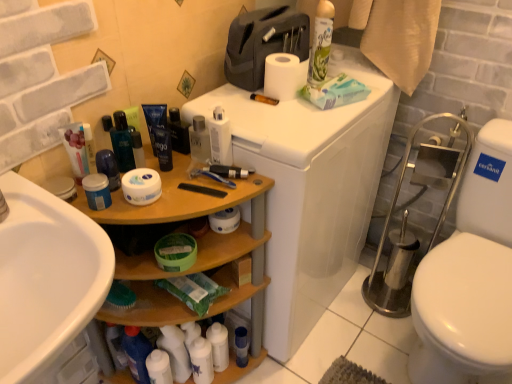
Question: Can we say wooden shelf at left lies outside shiny blue bottle at center?

Choices:
 (A) yes
 (B) no

Answer: (A)

Question: Does wooden shelf at left come behind shiny blue bottle at center?

Choices:
 (A) yes
 (B) no

Answer: (B)

Question: Does wooden shelf at left contain shiny blue bottle at center?

Choices:
 (A) yes
 (B) no

Answer: (B)

Question: From the image's perspective, is wooden shelf at left beneath shiny blue bottle at center?

Choices:
 (A) no
 (B) yes

Answer: (B)

Question: Does wooden shelf at left appear on the left side of shiny blue bottle at center?

Choices:
 (A) yes
 (B) no

Answer: (B)

Question: From a real-world perspective, is white matte toilet paper at upper center above or below white glossy bottle at lower center, the 3th toiletry when ordered from right to left?

Choices:
 (A) below
 (B) above

Answer: (B)

Question: Based on their positions, is white matte toilet paper at upper center located to the left or right of white glossy bottle at lower center, which is the tenth toiletry from left to right?

Choices:
 (A) left
 (B) right

Answer: (B)

Question: In terms of size, does white matte toilet paper at upper center appear bigger or smaller than white glossy bottle at lower center, the 3th toiletry when ordered from right to left?

Choices:
 (A) big
 (B) small

Answer: (A)

Question: Is white matte toilet paper at upper center in front of or behind white glossy bottle at lower center, the 3th toiletry when ordered from right to left, in the image?

Choices:
 (A) behind
 (B) front

Answer: (B)

Question: Is blue matte tube at center, placed as the 5th toiletry when sorted from left to right, inside or outside of white glossy lotion at lower center, which ranks as the sixth toiletry in left-to-right order?

Choices:
 (A) inside
 (B) outside

Answer: (B)

Question: Is blue matte tube at center, placed as the 5th toiletry when sorted from left to right, taller or shorter than white glossy lotion at lower center, which ranks as the sixth toiletry in left-to-right order?

Choices:
 (A) tall
 (B) short

Answer: (B)

Question: From the image's perspective, relative to white glossy lotion at lower center, which is the 7th toiletry from right to left, is blue matte tube at center, placed as the 5th toiletry when sorted from left to right, above or below?

Choices:
 (A) below
 (B) above

Answer: (B)

Question: Looking at the image, does blue matte tube at center, the eighth toiletry in the right-to-left sequence, seem bigger or smaller compared to white glossy lotion at lower center, which is the 7th toiletry from right to left?

Choices:
 (A) small
 (B) big

Answer: (A)

Question: Considering the positions of wooden shelf at left and blue matte jar at left, the eleventh toiletry viewed from the right, in the image, is wooden shelf at left bigger or smaller than blue matte jar at left, the eleventh toiletry viewed from the right,?

Choices:
 (A) small
 (B) big

Answer: (B)

Question: From the image's perspective, is wooden shelf at left above or below blue matte jar at left, which ranks as the 2th toiletry in left-to-right order?

Choices:
 (A) below
 (B) above

Answer: (A)